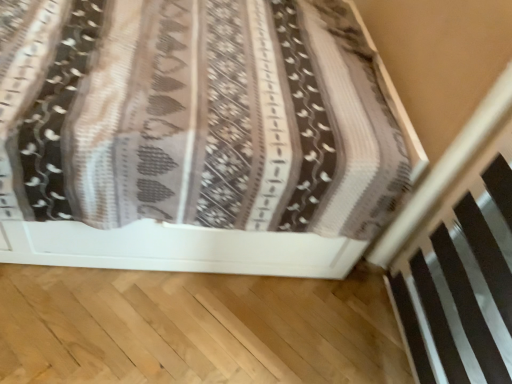
Locate an element on the screen. This screenshot has height=384, width=512. patterned fabric bed at center is located at coordinates (227, 144).

The height and width of the screenshot is (384, 512). What do you see at coordinates (227, 144) in the screenshot? I see `patterned fabric bed at center` at bounding box center [227, 144].

Identify the location of patterned fabric bed at center. The height and width of the screenshot is (384, 512). (227, 144).